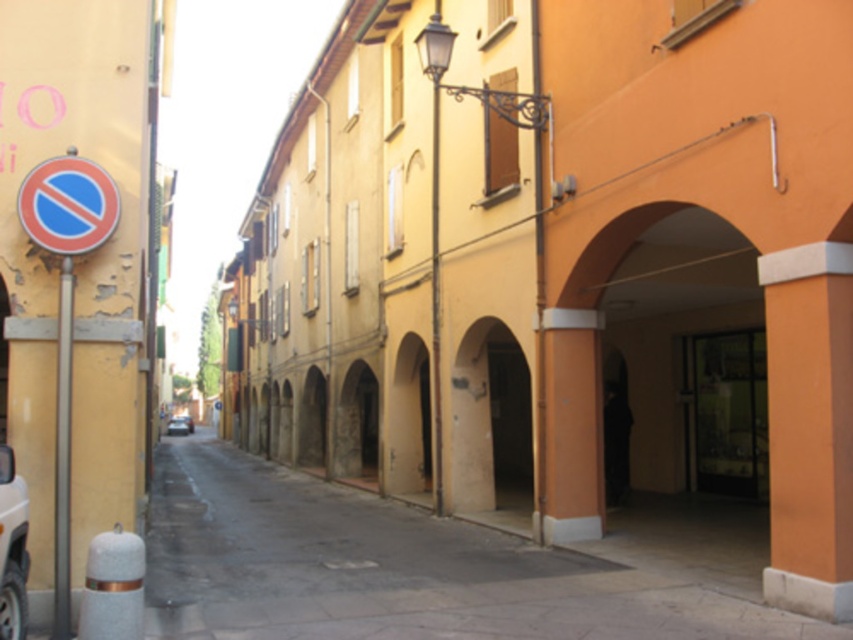
You are standing on the narrow street and want to walk from point (73, 225) to point (16, 529). Which direction should you face to move towards the point that is farther away from you?

You should face away from the point (73, 225) and towards the point (16, 529) because point (73, 225) is closer to you and point (16, 529) is farther away.

You are a driver trying to park your car in this narrow street. You see the blue plastic circle at upper left and the white matte car at lower left. Which object is closer to the left side of the street?

The blue plastic circle at upper left is positioned on the left side of the white matte car at lower left, meaning it is closer to the left side of the street.

You are a delivery person who needs to park your 1.8 meters tall delivery van. You see a white matte car at lower left and a metallic silver car at center. Can you park your van between them without hitting the no parking sign?

The white matte car at lower left has a greater height compared to metallic silver car at center. Since your van is 1.8 meters tall, you need to check the height clearance under the no parking sign. However, the description does not provide information about the height of the sign or the available space between the cars and the sign. Therefore, it is uncertain if the van can park there safely without hitting the sign.